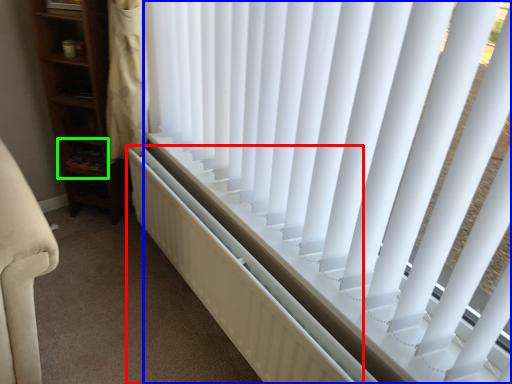
Question: Based on their relative distances, which object is farther from radiator (highlighted by a red box)? Choose from window blind (highlighted by a blue box) and shelf (highlighted by a green box).

Choices:
 (A) window blind
 (B) shelf

Answer: (B)